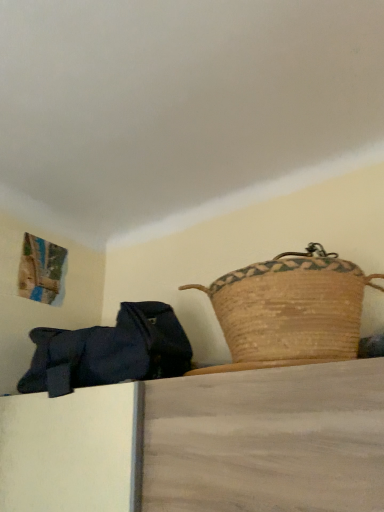
Question: Is dark blue fabric bag at left taller or shorter than brown woven picnic basket at upper right?

Choices:
 (A) short
 (B) tall

Answer: (B)

Question: From the image's perspective, is dark blue fabric bag at left located above or below brown woven picnic basket at upper right?

Choices:
 (A) above
 (B) below

Answer: (B)

Question: In terms of width, does dark blue fabric bag at left look wider or thinner when compared to brown woven picnic basket at upper right?

Choices:
 (A) thin
 (B) wide

Answer: (A)

Question: Do you think brown woven picnic basket at upper right is within dark blue fabric bag at left, or outside of it?

Choices:
 (A) outside
 (B) inside

Answer: (A)

Question: From a real-world perspective, is brown woven picnic basket at upper right positioned above or below dark blue fabric bag at left?

Choices:
 (A) below
 (B) above

Answer: (B)

Question: In terms of width, does brown woven picnic basket at upper right look wider or thinner when compared to dark blue fabric bag at left?

Choices:
 (A) thin
 (B) wide

Answer: (B)

Question: Is brown woven picnic basket at upper right to the left or to the right of dark blue fabric bag at left in the image?

Choices:
 (A) right
 (B) left

Answer: (A)